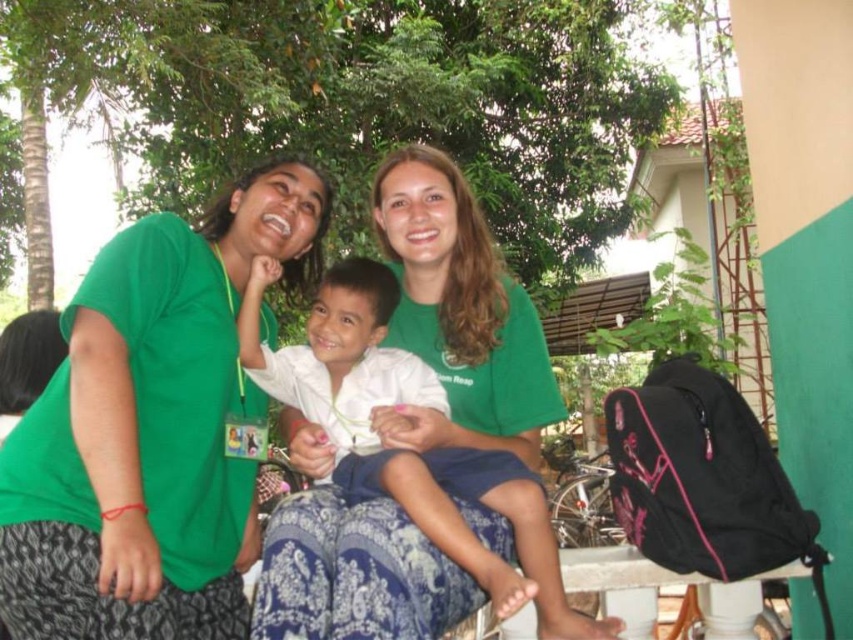
Question: Which point appears closest to the camera in this image?

Choices:
 (A) (340, 467)
 (B) (524, 346)
 (C) (126, 554)

Answer: (C)

Question: Is green fabric shirt at center positioned before white cotton shirt at center?

Choices:
 (A) yes
 (B) no

Answer: (B)

Question: Which object is closer to the camera taking this photo?

Choices:
 (A) green cotton shirt at center
 (B) green fabric shirt at center
 (C) white cotton shirt at center

Answer: (C)

Question: Can you confirm if green fabric shirt at center is positioned to the right of white cotton shirt at center?

Choices:
 (A) yes
 (B) no

Answer: (B)

Question: Among these points, which one is farthest from the camera?

Choices:
 (A) (335, 333)
 (B) (460, 337)

Answer: (B)

Question: Is green fabric shirt at center bigger than white cotton shirt at center?

Choices:
 (A) no
 (B) yes

Answer: (B)